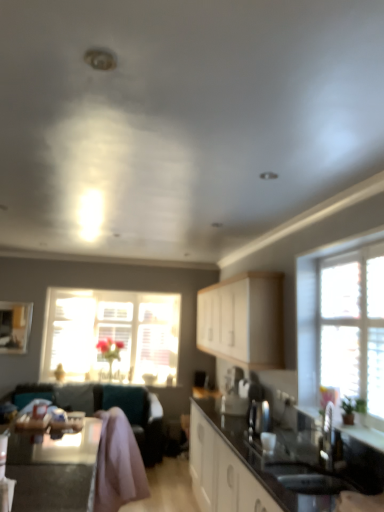
Question: Is teal fabric couch at lower left at the left side of satin silver kettle at center?

Choices:
 (A) yes
 (B) no

Answer: (A)

Question: Is satin silver kettle at center at the back of teal fabric couch at lower left?

Choices:
 (A) yes
 (B) no

Answer: (B)

Question: From a real-world perspective, is teal fabric couch at lower left over satin silver kettle at center?

Choices:
 (A) no
 (B) yes

Answer: (A)

Question: Is teal fabric couch at lower left smaller than satin silver kettle at center?

Choices:
 (A) no
 (B) yes

Answer: (A)

Question: Considering the relative sizes of teal fabric couch at lower left and satin silver kettle at center in the image provided, is teal fabric couch at lower left bigger than satin silver kettle at center?

Choices:
 (A) no
 (B) yes

Answer: (B)

Question: Considering the relative positions of black glossy table at lower left and white matte cabinet at center in the image provided, is black glossy table at lower left to the left or to the right of white matte cabinet at center?

Choices:
 (A) left
 (B) right

Answer: (A)

Question: Does point (49, 445) appear closer or farther from the camera than point (256, 337)?

Choices:
 (A) farther
 (B) closer

Answer: (B)

Question: Which is correct: black glossy table at lower left is inside white matte cabinet at center, or outside of it?

Choices:
 (A) outside
 (B) inside

Answer: (A)

Question: Is black glossy table at lower left in front of or behind white matte cabinet at center in the image?

Choices:
 (A) front
 (B) behind

Answer: (A)

Question: From a real-world perspective, is black glossy countertop at center positioned above or below white matte cabinet at center?

Choices:
 (A) above
 (B) below

Answer: (B)

Question: From the image's perspective, relative to white matte cabinet at center, is black glossy countertop at center above or below?

Choices:
 (A) below
 (B) above

Answer: (A)

Question: Is black glossy countertop at center bigger or smaller than white matte cabinet at center?

Choices:
 (A) small
 (B) big

Answer: (B)

Question: Is black glossy countertop at center wider or thinner than white matte cabinet at center?

Choices:
 (A) wide
 (B) thin

Answer: (A)

Question: Based on their positions, is translucent glass window at center, which is the first window in left-to-right order, located to the left or right of teal fabric couch at lower left?

Choices:
 (A) right
 (B) left

Answer: (A)

Question: Looking at the image, does translucent glass window at center, which is the second window from front to back, seem bigger or smaller compared to teal fabric couch at lower left?

Choices:
 (A) big
 (B) small

Answer: (B)